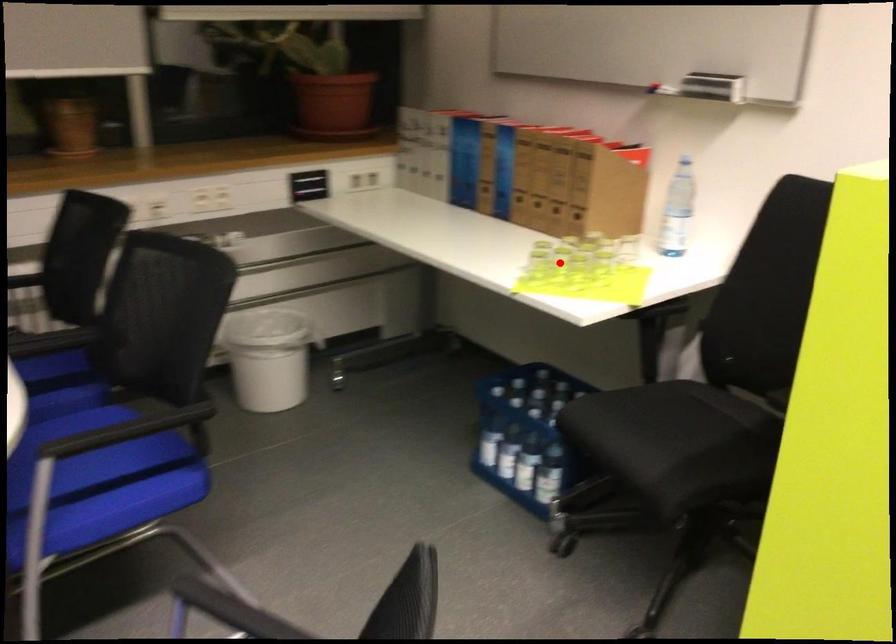
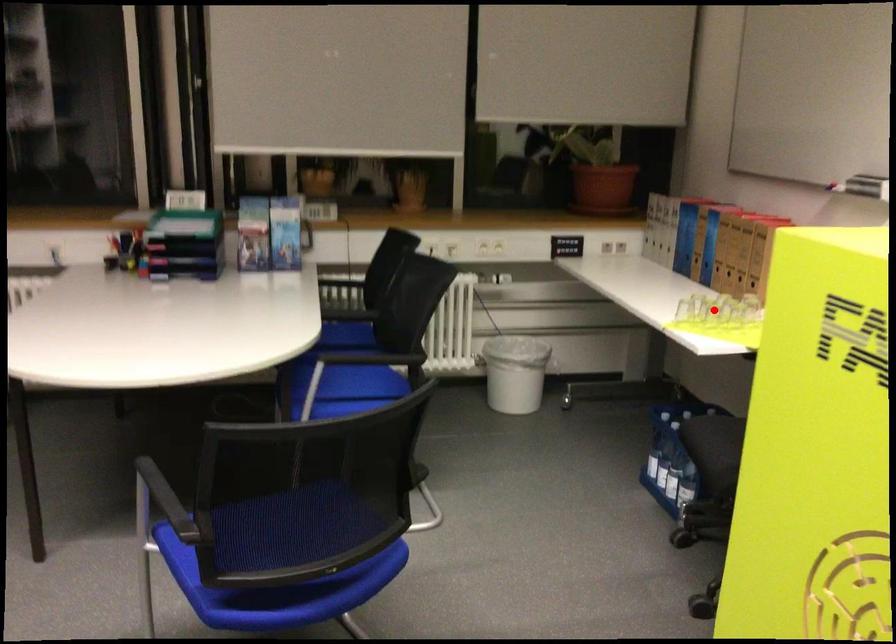
I am providing you with two images of the same scene from different viewpoints. A red point is marked on the first image and another point is marked on the second image. Do the highlighted points in image1 and image2 indicate the same real-world spot?

Yes